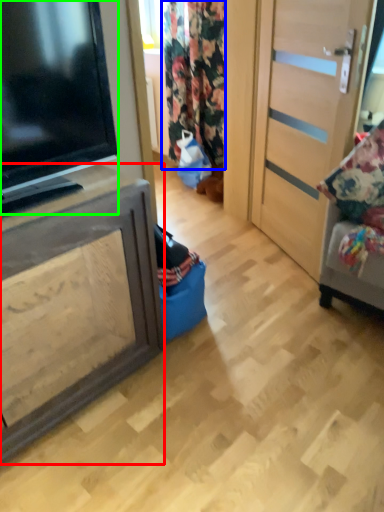
Question: Which object is the closest to the cabinetry (highlighted by a red box)? Choose among these: curtain (highlighted by a blue box) or television (highlighted by a green box).

Choices:
 (A) curtain
 (B) television

Answer: (B)